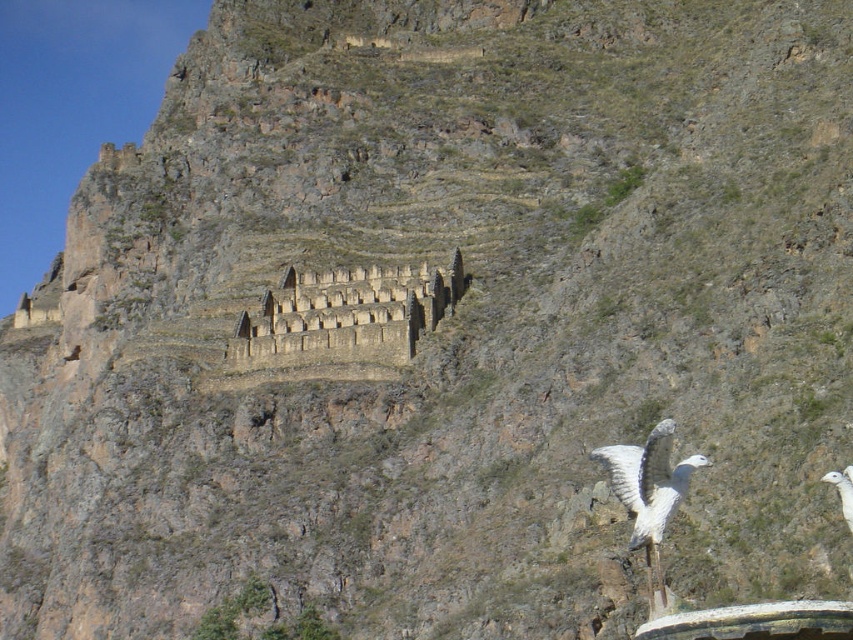
Question: Among these objects, which one is farthest from the camera?

Choices:
 (A) white feathered bird at lower right
 (B) stone/rough stone structure at center
 (C) white matte bird at lower right

Answer: (B)

Question: Can you confirm if stone/rough stone structure at center is positioned below white matte bird at lower right?

Choices:
 (A) no
 (B) yes

Answer: (A)

Question: Which point is closer to the camera?

Choices:
 (A) (344, 358)
 (B) (670, 449)
 (C) (850, 467)

Answer: (B)

Question: Which object is closer to the camera taking this photo?

Choices:
 (A) stone/rough stone structure at center
 (B) white matte bird at lower right

Answer: (B)

Question: From the image, what is the correct spatial relationship of stone/rough stone structure at center in relation to white feathered bird at lower right?

Choices:
 (A) right
 (B) left

Answer: (B)

Question: From the image, what is the correct spatial relationship of white feathered bird at lower right in relation to white matte bird at lower right?

Choices:
 (A) below
 (B) above

Answer: (A)